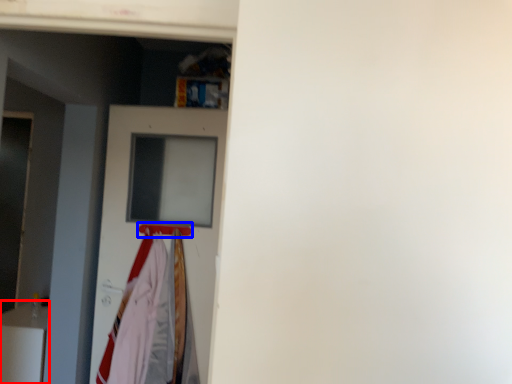
Question: Which object is further to the camera taking this photo, furniture (highlighted by a red box) or hanger (highlighted by a blue box)?

Choices:
 (A) furniture
 (B) hanger

Answer: (A)